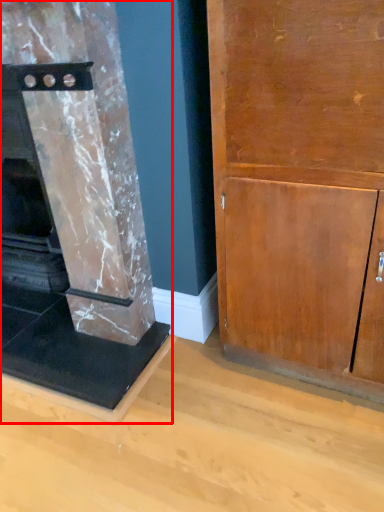
Question: From the image's perspective, where is fireplace (annotated by the red box) located relative to cupboard?

Choices:
 (A) above
 (B) below

Answer: (A)